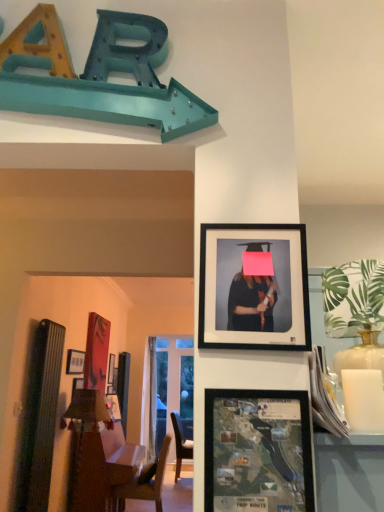
Question: Considering the relative sizes of matte black picture frame at upper left, marked as the third picture frame in a top-to-bottom arrangement, and wooden bulletin board at left in the image provided, is matte black picture frame at upper left, marked as the third picture frame in a top-to-bottom arrangement, bigger than wooden bulletin board at left?

Choices:
 (A) no
 (B) yes

Answer: (A)

Question: From a real-world perspective, is matte black picture frame at upper left, which appears as the first picture frame when viewed from the back, over wooden bulletin board at left?

Choices:
 (A) yes
 (B) no

Answer: (A)

Question: Considering the relative positions of matte black picture frame at upper left, marked as the 1th picture frame in a left-to-right arrangement, and wooden bulletin board at left in the image provided, is matte black picture frame at upper left, marked as the 1th picture frame in a left-to-right arrangement, in front of wooden bulletin board at left?

Choices:
 (A) yes
 (B) no

Answer: (B)

Question: From the image's perspective, is matte black picture frame at upper left, acting as the third picture frame starting from the right, located beneath wooden bulletin board at left?

Choices:
 (A) no
 (B) yes

Answer: (A)

Question: Is matte black picture frame at upper left, marked as the third picture frame in a top-to-bottom arrangement, positioned with its back to wooden bulletin board at left?

Choices:
 (A) yes
 (B) no

Answer: (B)

Question: In terms of width, does matte black picture frame at upper left, which appears as the first picture frame when viewed from the back, look wider or thinner when compared to matte black frame at upper center, marked as the 2th picture frame in a front-to-back arrangement?

Choices:
 (A) thin
 (B) wide

Answer: (B)

Question: From a real-world perspective, relative to matte black frame at upper center, the 2th picture frame from the back, is matte black picture frame at upper left, the third picture frame viewed from the front, vertically above or below?

Choices:
 (A) above
 (B) below

Answer: (B)

Question: From their relative heights in the image, would you say matte black picture frame at upper left, which appears as the first picture frame when viewed from the back, is taller or shorter than matte black frame at upper center, marked as the 2th picture frame in a front-to-back arrangement?

Choices:
 (A) short
 (B) tall

Answer: (A)

Question: Looking at the image, does matte black picture frame at upper left, acting as the third picture frame starting from the right, seem bigger or smaller compared to matte black frame at upper center, positioned as the 1th picture frame in right-to-left order?

Choices:
 (A) big
 (B) small

Answer: (A)

Question: Looking at their shapes, would you say matte plastic map at center, which is the first picture frame from front to back, is wider or thinner than matte black picture frame at upper left, acting as the third picture frame starting from the right?

Choices:
 (A) thin
 (B) wide

Answer: (A)

Question: From a real-world perspective, relative to matte black picture frame at upper left, positioned as the 1th picture frame in bottom-to-top order, is matte plastic map at center, which appears as the 2th picture frame when viewed from the top, vertically above or below?

Choices:
 (A) above
 (B) below

Answer: (B)

Question: Considering their positions, is matte plastic map at center, which is the 2th picture frame in right-to-left order, located in front of or behind matte black picture frame at upper left, marked as the third picture frame in a top-to-bottom arrangement?

Choices:
 (A) front
 (B) behind

Answer: (A)

Question: Considering the positions of matte plastic map at center, which appears as the third picture frame when viewed from the back, and matte black picture frame at upper left, marked as the third picture frame in a top-to-bottom arrangement, in the image, is matte plastic map at center, which appears as the third picture frame when viewed from the back, bigger or smaller than matte black picture frame at upper left, marked as the third picture frame in a top-to-bottom arrangement,?

Choices:
 (A) small
 (B) big

Answer: (A)

Question: Is wooden bulletin board at left bigger or smaller than matte plastic map at center, the 2th picture frame in the bottom-to-top sequence?

Choices:
 (A) big
 (B) small

Answer: (A)

Question: In terms of width, does wooden bulletin board at left look wider or thinner when compared to matte plastic map at center, which appears as the third picture frame when viewed from the back?

Choices:
 (A) thin
 (B) wide

Answer: (B)